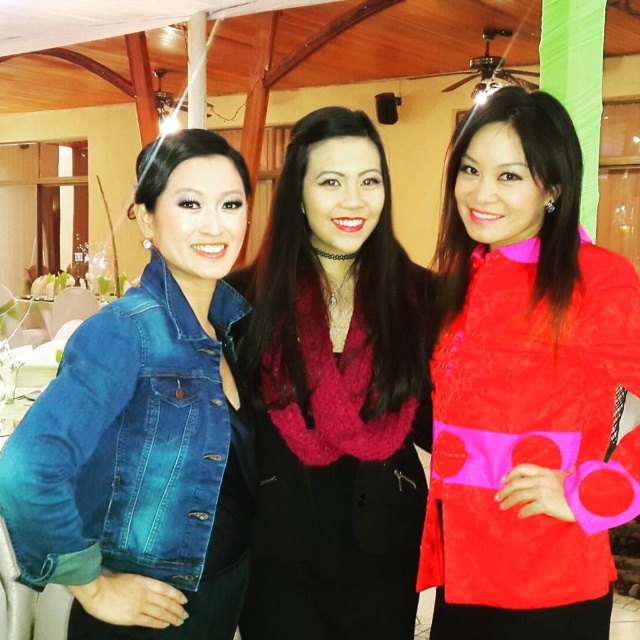
Question: Does denim jacket at left have a smaller size compared to velvet red scarf at center?

Choices:
 (A) no
 (B) yes

Answer: (A)

Question: Can you confirm if suede red blouse at center is wider than denim jacket at left?

Choices:
 (A) yes
 (B) no

Answer: (A)

Question: Which point appears farthest from the camera in this image?

Choices:
 (A) (374, 308)
 (B) (474, 609)

Answer: (A)

Question: Does denim jacket at left appear over velvet red scarf at center?

Choices:
 (A) yes
 (B) no

Answer: (B)

Question: Which object is farther from the camera taking this photo?

Choices:
 (A) suede red blouse at center
 (B) denim jacket at left
 (C) velvet red scarf at center

Answer: (C)

Question: Which of these objects is positioned closest to the denim jacket at left?

Choices:
 (A) suede red blouse at center
 (B) velvet red scarf at center

Answer: (B)